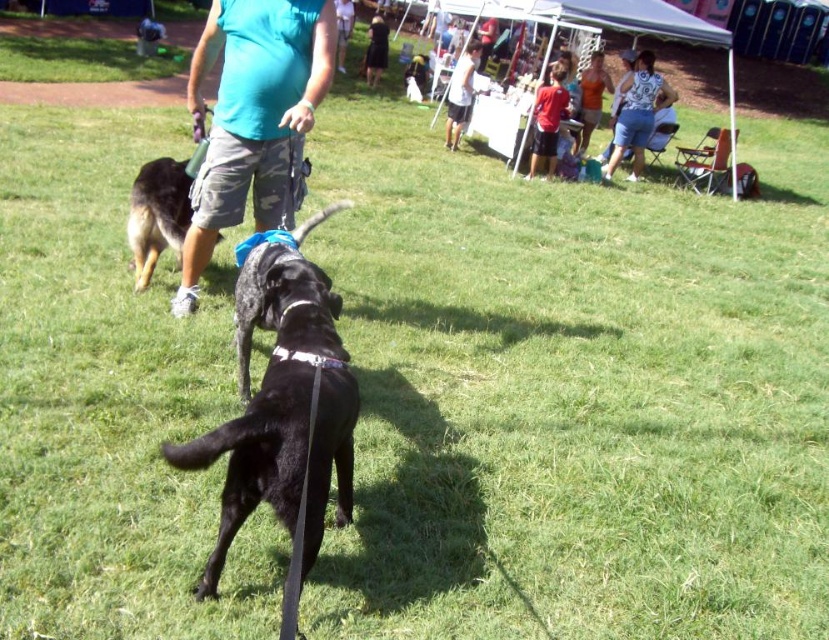
What are the coordinates of the matte red shirt at center?

The coordinates of the matte red shirt at center are point (548,120).

Looking at this image, you are a photographer trying to capture both the black matte dog at center and the black smooth dog at center in a single shot. Based on their positions, which dog might be partially obscured by the other?

The black matte dog at center is positioned under the black smooth dog at center, so the black matte dog at center might be partially obscured by the black smooth dog at center.

You are attending a community event and see two dresses in the distance. The white cotton dress at upper right and the black dress at center. Which dress is located to the right of the other?

The white cotton dress at upper right is positioned on the right side of black dress at center.